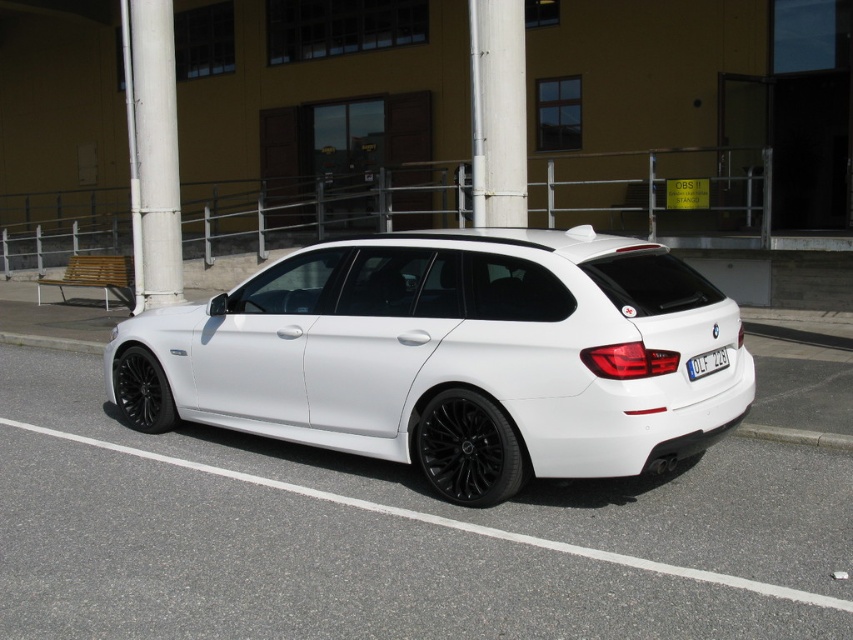
You are a delivery driver who needs to park your truck next to the white painted metal pole at upper left. The truck is 2.5 meters wide. Can the white matte car at center, which is currently parked, fit between the pole and the sidewalk railing without overlapping?

The white matte car at center might be wider than white painted metal pole at upper left, so there is a possibility that the car is too wide to fit between the pole and the railing. You should check the exact width before attempting to park.

Based on the scene description, where is the black matte wheel at lower left located in terms of coordinates?

The black matte wheel at lower left is located at coordinates point (142, 392).

You are a delivery driver who needs to park your white matte car at center in a specific spot. The parking spot is located at coordinate point 0.556, 0.544. Is your car already parked in the correct spot?

Yes, the white matte car at center is already parked in the correct spot because its 2D location matches the coordinates provided.